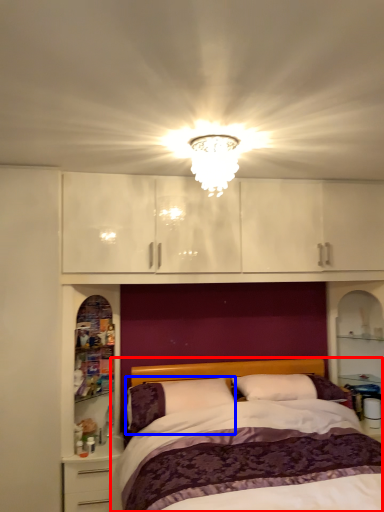
Question: Among these objects, which one is farthest to the camera, bed (highlighted by a red box) or pillow (highlighted by a blue box)?

Choices:
 (A) bed
 (B) pillow

Answer: (B)